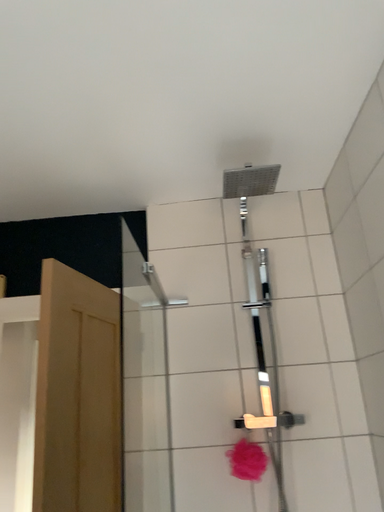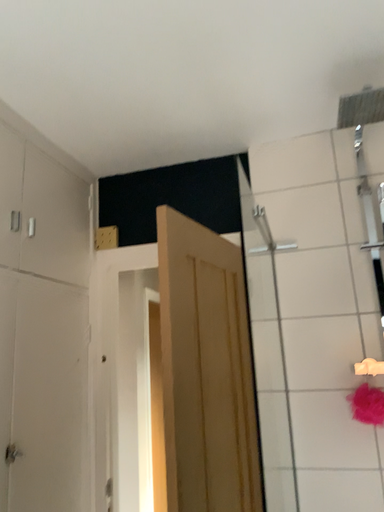
Question: Which way did the camera rotate in the video?

Choices:
 (A) rotated left
 (B) rotated right

Answer: (A)